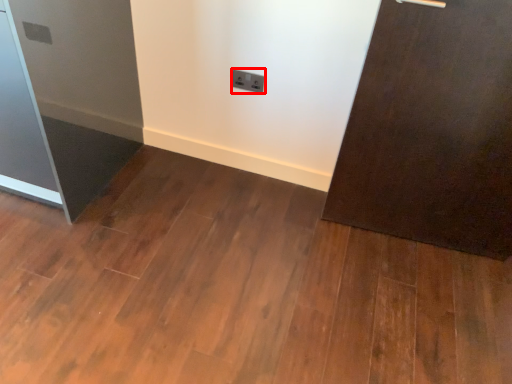
Question: From the image's perspective, where is electric outlet (annotated by the red box) located in relation to fridge in the image?

Choices:
 (A) below
 (B) above

Answer: (B)